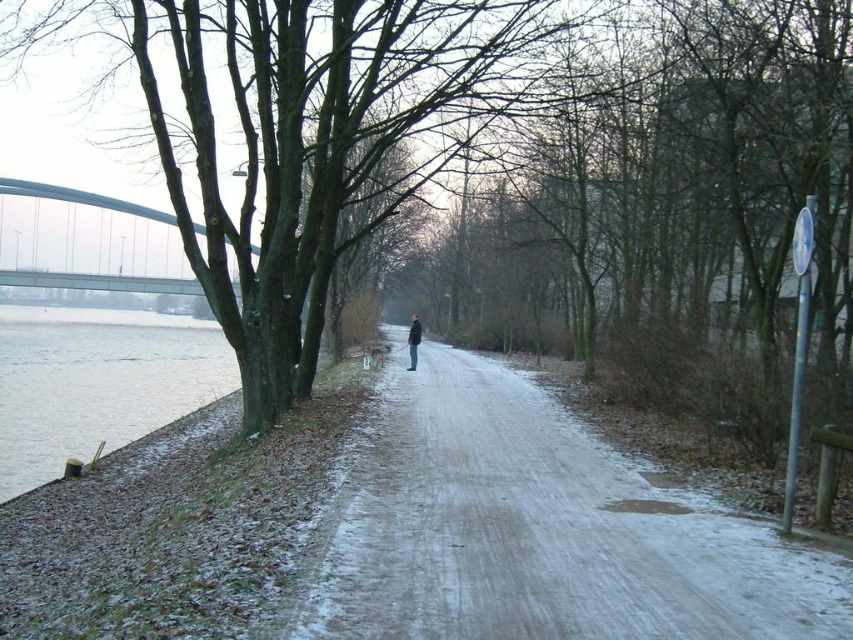
Question: Which point appears farthest from the camera in this image?

Choices:
 (A) (403, 451)
 (B) (416, 337)

Answer: (B)

Question: Estimate the real-world distances between objects in this image. Which object is closer to the gray concrete bridge at upper left?

Choices:
 (A) dark gray jacket at center
 (B) sandy dirt road at center

Answer: (A)

Question: Does gray concrete bridge at upper left appear over dark gray jacket at center?

Choices:
 (A) yes
 (B) no

Answer: (A)

Question: Estimate the real-world distances between objects in this image. Which object is closer to the gray concrete bridge at upper left?

Choices:
 (A) dark gray jacket at center
 (B) sandy dirt road at center

Answer: (A)

Question: Does sandy dirt road at center have a smaller size compared to dark gray jacket at center?

Choices:
 (A) yes
 (B) no

Answer: (B)

Question: Can you confirm if sandy dirt road at center is smaller than dark gray jacket at center?

Choices:
 (A) yes
 (B) no

Answer: (B)